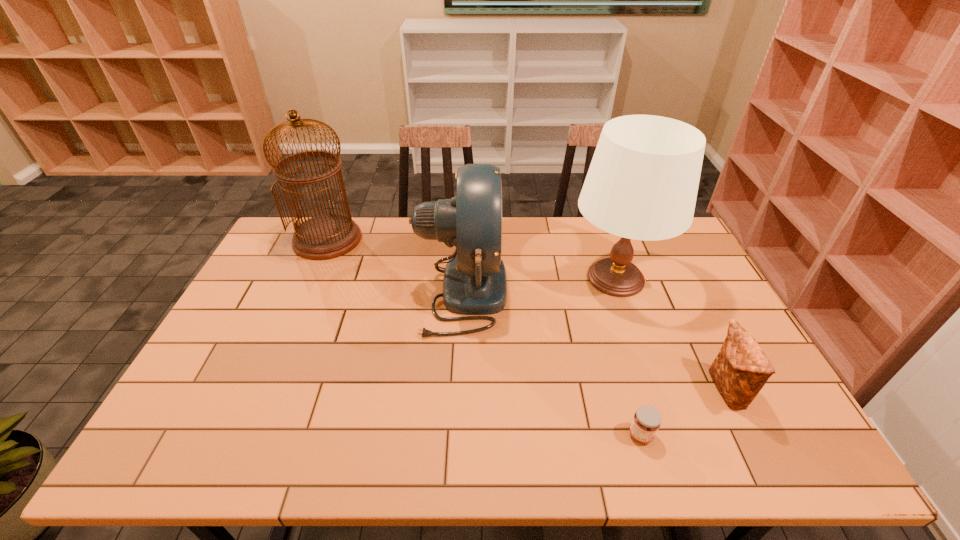
Where is `lamp`? The image size is (960, 540). lamp is located at coordinates (642, 183).

At what (x,y) coordinates should I click in order to perform the action: click on the leftmost object. Please return your answer as a coordinate pair (x, y). This screenshot has height=540, width=960. Looking at the image, I should click on click(327, 236).

Image resolution: width=960 pixels, height=540 pixels. Find the location of `the third shortest object`. the third shortest object is located at coordinates (474, 283).

This screenshot has height=540, width=960. I want to click on fan, so click(x=474, y=283).

Find the location of `clutch bag`. clutch bag is located at coordinates tap(741, 369).

Where is `the second shortest object`? the second shortest object is located at coordinates (741, 369).

What are the coordinates of `the shortest object` in the screenshot? It's located at (647, 420).

Find the location of a particular element. jam is located at coordinates (647, 420).

Find the location of a particular element. vacant space located on the left of the lamp is located at coordinates (490, 278).

I want to click on free region located on the front-facing side of the leftmost object, so [x=311, y=278].